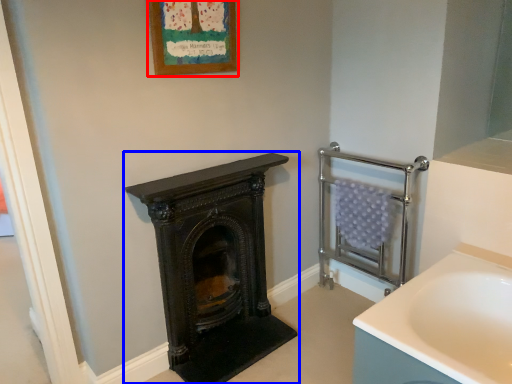
Question: Which object is further to the camera taking this photo, picture frame (highlighted by a red box) or wood burning stove (highlighted by a blue box)?

Choices:
 (A) picture frame
 (B) wood burning stove

Answer: (B)